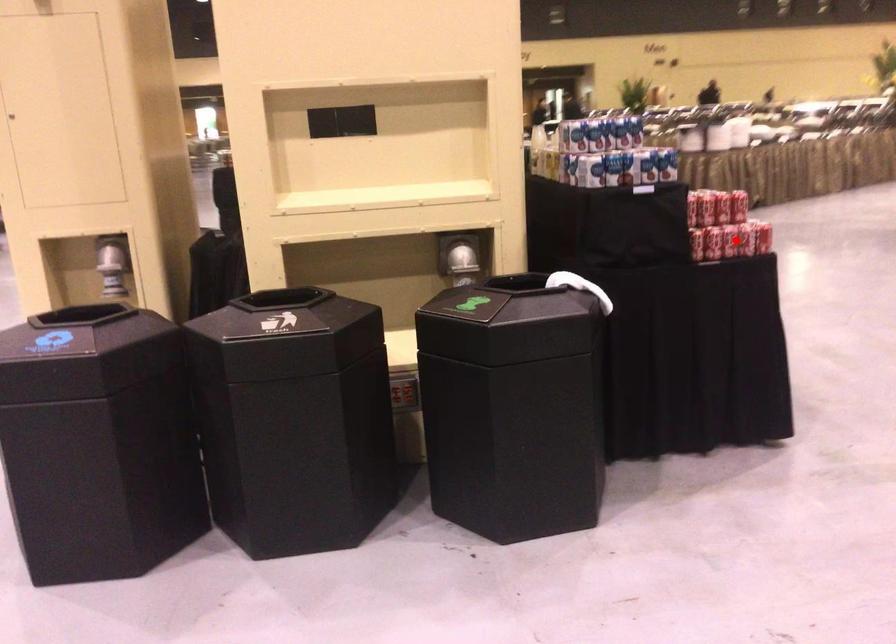
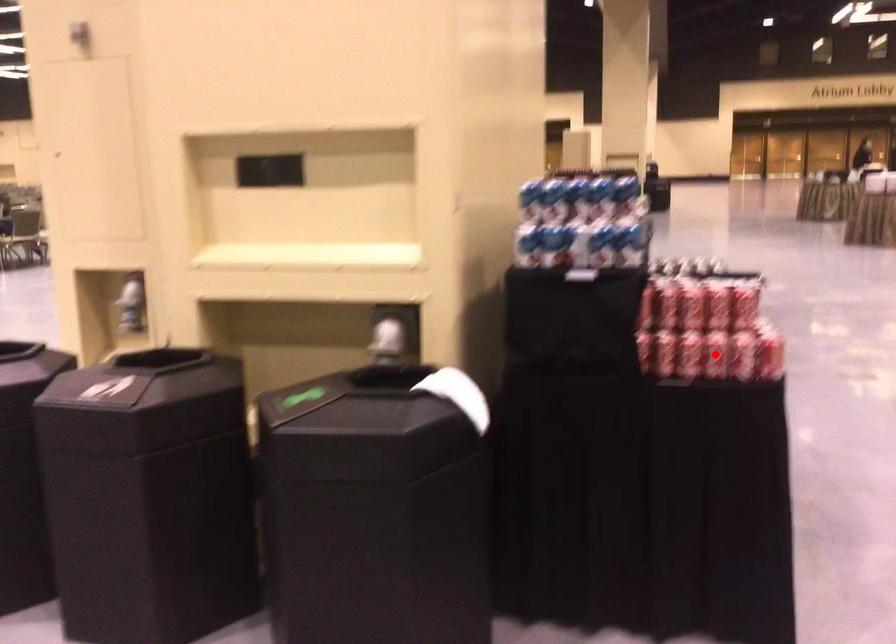
I am providing you with two images of the same scene from different viewpoints. A red point is marked on the first image and another point is marked on the second image. Is the marked point in image1 the same physical position as the marked point in image2?

Yes